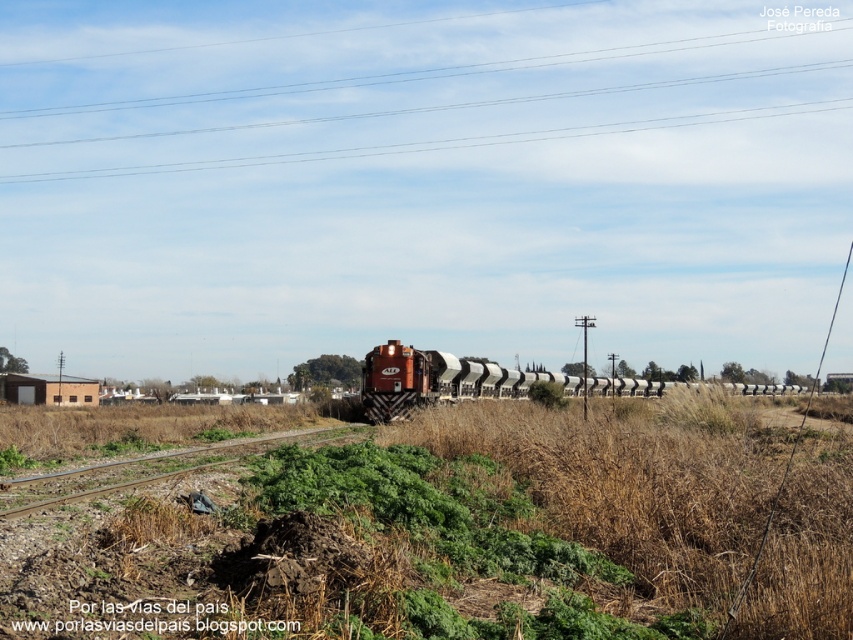
You are a bird flying over the rural railway scene. You notice metallic wires at upper center and brown gravel track at lower center. Which one appears wider from your aerial view?

The metallic wires at upper center might be wider than brown gravel track at lower center according to the description.

You are a photographer trying to capture the matte orange train at center and the brown gravel track at lower center in a single shot. Based on their sizes in the image, which object will appear larger in your photo?

The matte orange train at center will appear larger in the photo because it is bigger than the brown gravel track at lower center according to the description.

You are standing at the point marked by coordinates point (x=466, y=381) in the image. What object are you directly in front of?

The point (x=466, y=381) indicates matte orange train at center, so you are directly in front of the matte orange train at center.